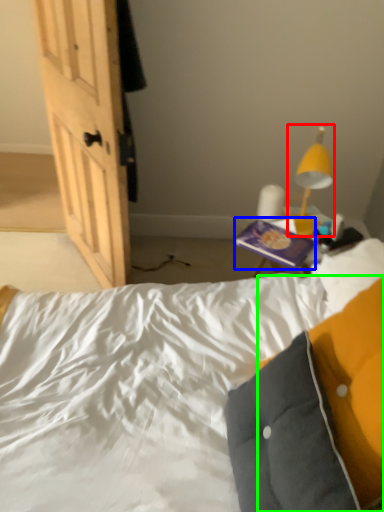
Question: Estimate the real-world distances between objects in this image. Which object is farther from lamp (highlighted by a red box), paperback book (highlighted by a blue box) or pillow (highlighted by a green box)?

Choices:
 (A) paperback book
 (B) pillow

Answer: (B)